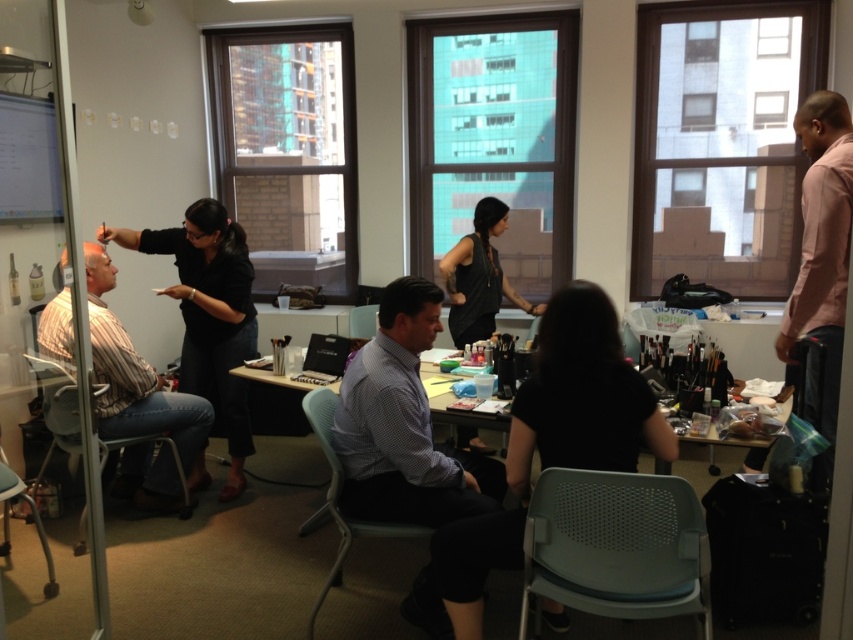
Question: Which of the following is the farthest from the observer?

Choices:
 (A) (670, 440)
 (B) (373, 474)

Answer: (B)

Question: Considering the relative positions of striped cotton shirt at left and dark brown hair at center in the image provided, where is striped cotton shirt at left located with respect to dark brown hair at center?

Choices:
 (A) left
 (B) right

Answer: (A)

Question: Which point is closer to the camera taking this photo?

Choices:
 (A) (74, 401)
 (B) (167, 486)
 (C) (381, 378)
 (D) (463, 244)

Answer: (A)

Question: Can you confirm if striped cotton shirt at left is positioned to the left of black matte tank top at center?

Choices:
 (A) yes
 (B) no

Answer: (A)

Question: Does checkered fabric shirt at center have a larger size compared to striped cotton shirt at left?

Choices:
 (A) yes
 (B) no

Answer: (B)

Question: Which of the following is the closest to the observer?

Choices:
 (A) (218, 240)
 (B) (494, 212)
 (C) (477, 291)
 (D) (845, 116)

Answer: (D)